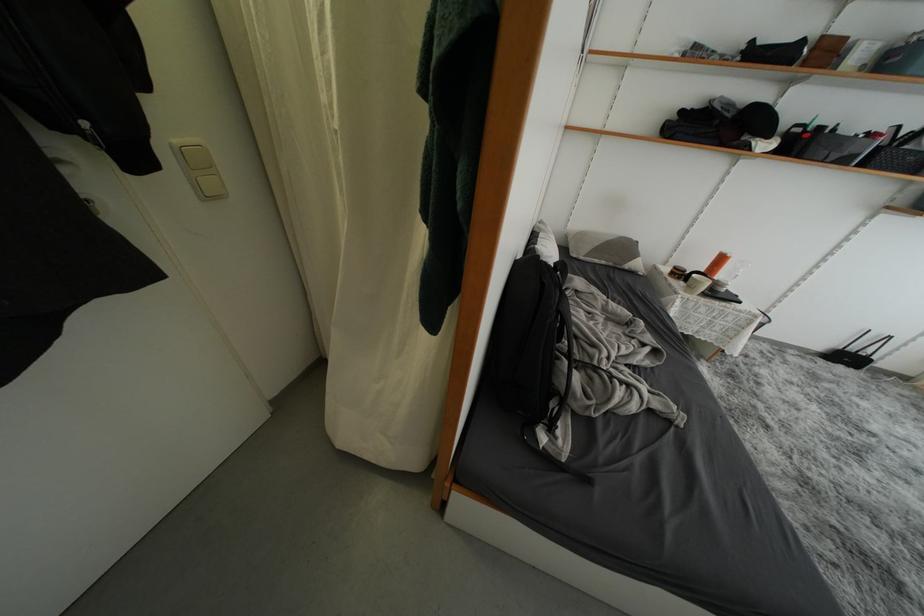
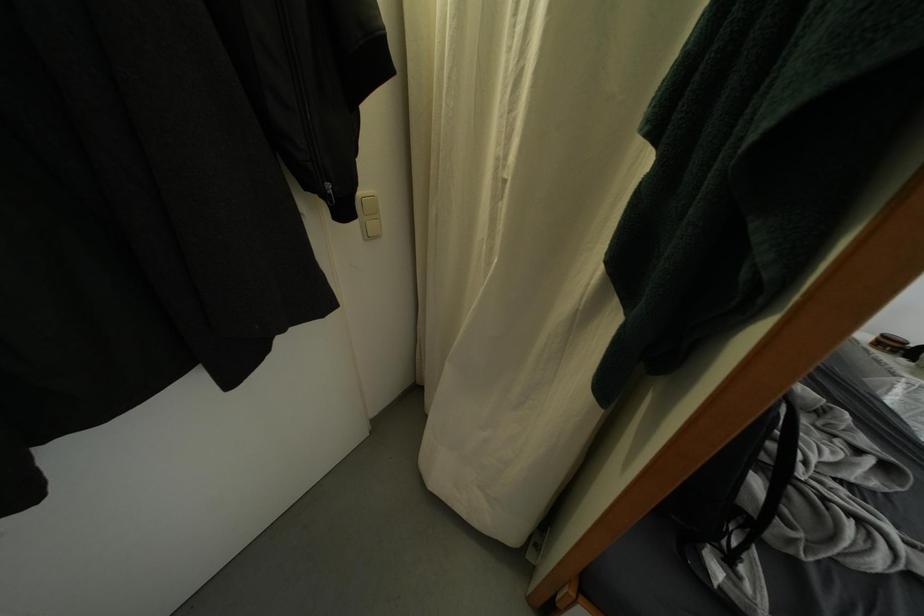
Find the pixel in the second image that matches the point at 569,408 in the first image.

(759, 531)